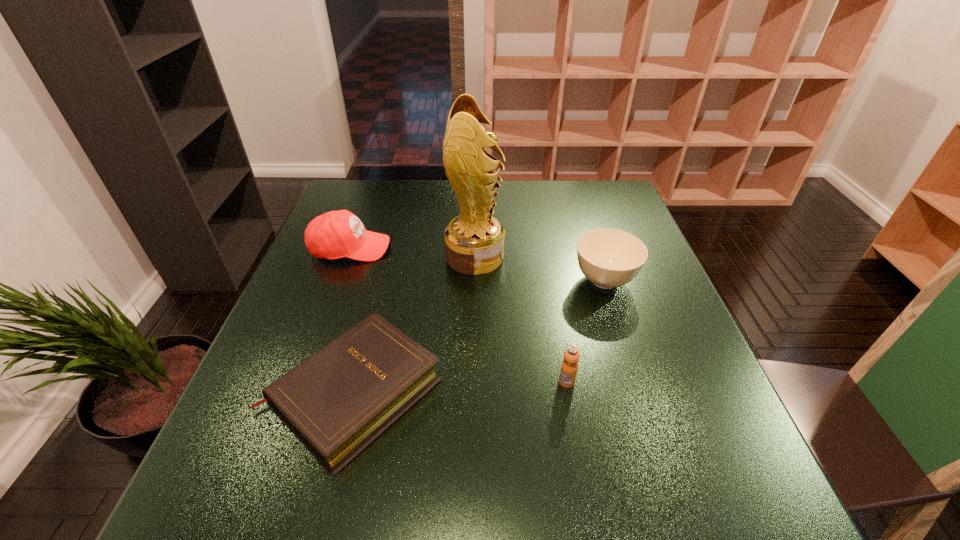
The height and width of the screenshot is (540, 960). In order to click on free space that satisfies the following two spatial constraints: 1. on the back side of the shortest object; 2. on the right side of the rightmost object in this screenshot , I will do `click(382, 281)`.

In order to click on vacant region that satisfies the following two spatial constraints: 1. on the front-facing side of the award; 2. on the front side of the Bible in this screenshot , I will do `click(473, 392)`.